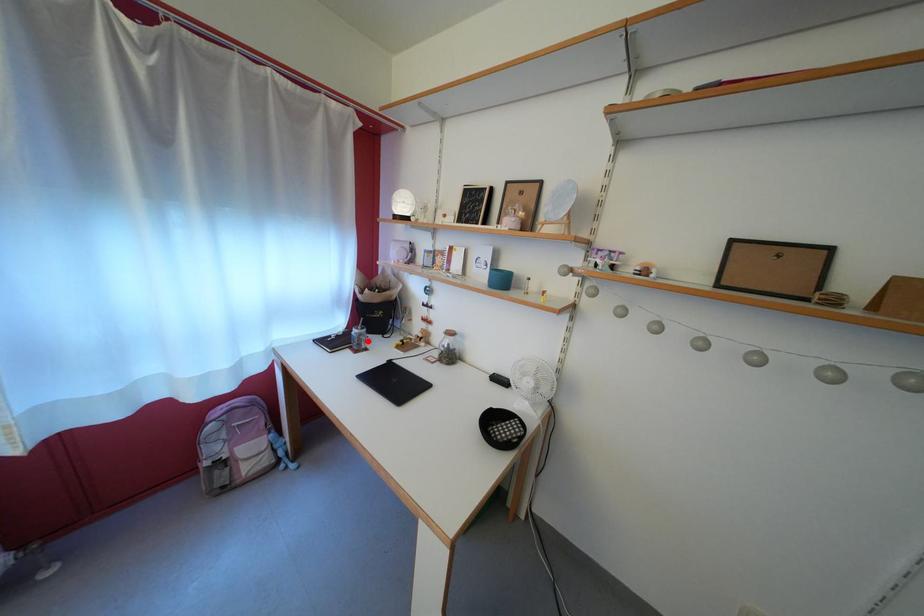
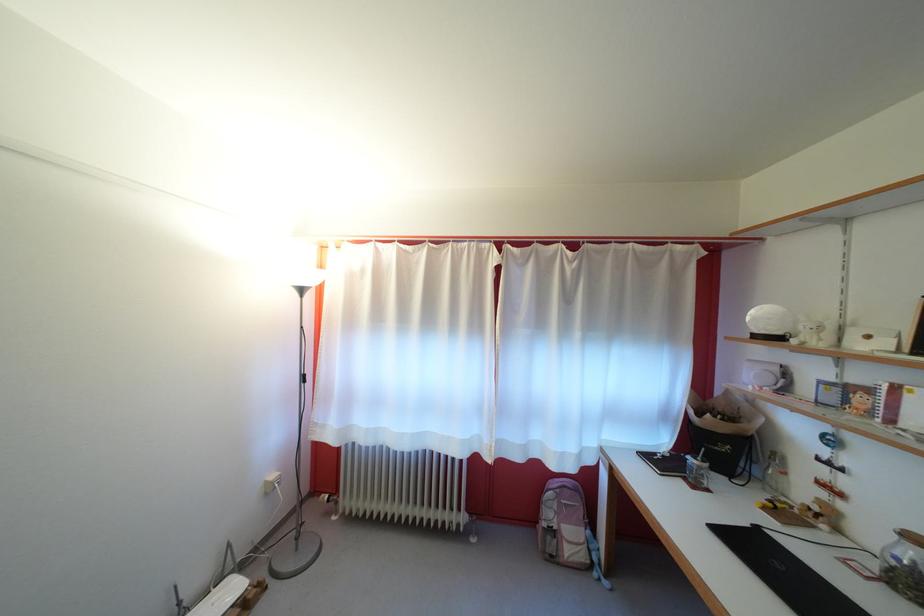
The point at the highlighted location is marked in the first image. Where is the corresponding point in the second image?

(708, 474)